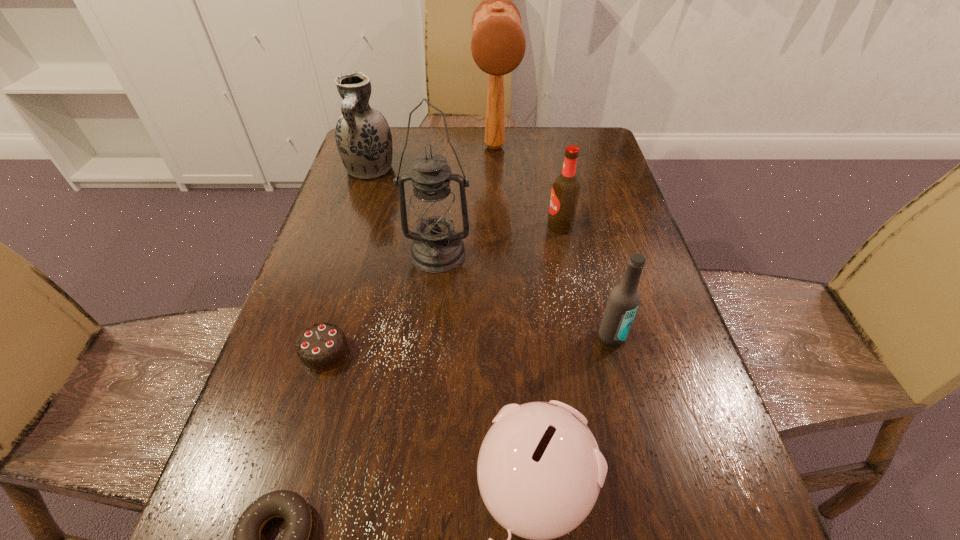
Locate an element on the screen. This screenshot has width=960, height=540. free spot located 0.340m on the back of the farther beer bottle is located at coordinates (544, 150).

Image resolution: width=960 pixels, height=540 pixels. Find the location of `vacant space situated on the side of the rightmost object with the label`. vacant space situated on the side of the rightmost object with the label is located at coordinates (645, 469).

Locate an element on the screen. free spot located on the front of the second shortest object is located at coordinates (311, 397).

Locate an element on the screen. This screenshot has height=540, width=960. mallet that is at the far edge is located at coordinates (498, 44).

Find the location of `vase that is at the far edge`. vase that is at the far edge is located at coordinates point(363,137).

Where is `vase present at the left edge`? vase present at the left edge is located at coordinates (363, 137).

Where is `chocolate cake located in the left edge section of the desktop`? chocolate cake located in the left edge section of the desktop is located at coordinates (321, 347).

Where is `object at the far left corner`? object at the far left corner is located at coordinates (x=363, y=137).

In the image, there is a desktop. Find the location of `free space at the far edge`. free space at the far edge is located at coordinates (555, 157).

In the image, there is a desktop. Identify the location of vacant space at the left edge. This screenshot has height=540, width=960. coord(364,222).